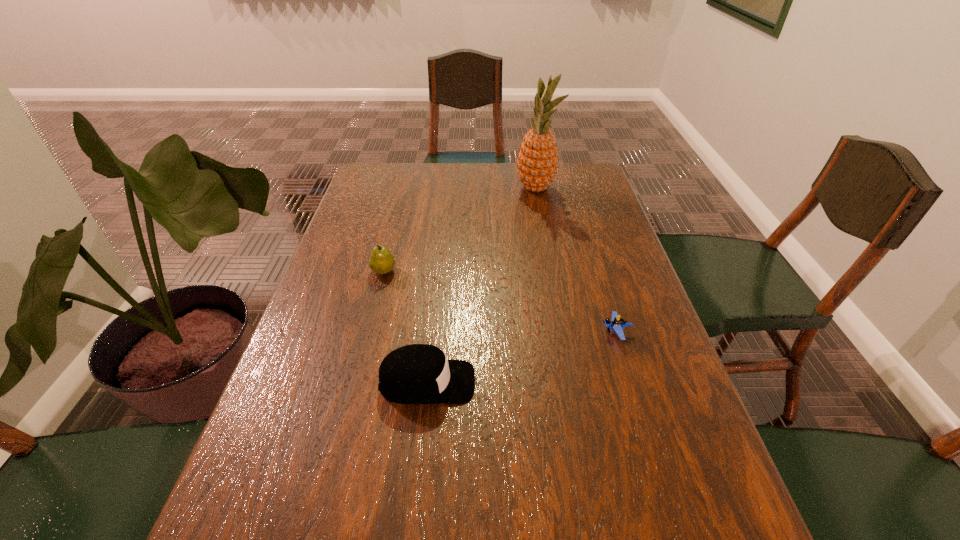
Where is `vacant space located on the front-facing side of the second object from left to right`? vacant space located on the front-facing side of the second object from left to right is located at coordinates (552, 382).

The image size is (960, 540). I want to click on free space located 0.060m on the front-facing side of the shortest object, so click(x=574, y=333).

Locate an element on the screen. free space located 0.250m on the front-facing side of the shortest object is located at coordinates (492, 333).

Identify the location of vacant space located 0.210m on the front-facing side of the shortest object. (510, 333).

Find the location of a particular element. object situated at the far edge is located at coordinates (537, 161).

Where is `object that is at the left edge`? The height and width of the screenshot is (540, 960). object that is at the left edge is located at coordinates (381, 261).

This screenshot has height=540, width=960. Identify the location of pineapple that is at the right edge. (537, 161).

I want to click on Lego positioned at the right edge, so click(x=616, y=324).

The width and height of the screenshot is (960, 540). What are the coordinates of `object located at the far right corner` in the screenshot? It's located at (537, 161).

In the image, there is a desktop. At what (x,y) coordinates should I click in order to perform the action: click on free space at the far edge. Please return your answer as a coordinate pair (x, y). The image size is (960, 540). Looking at the image, I should click on (410, 196).